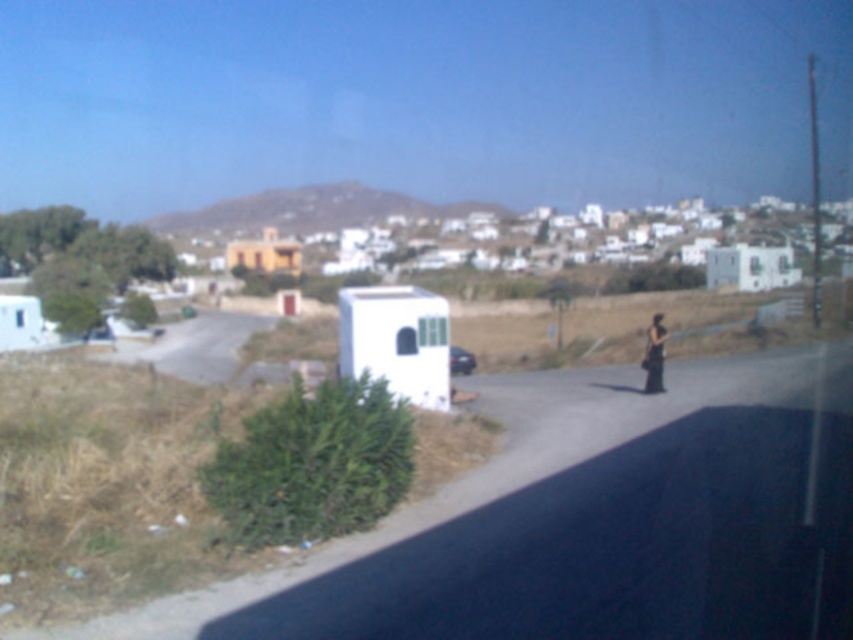
Between black fabric bag at center and white matte trailer at center, which one is positioned higher?

black fabric bag at center is higher up.

What do you see at coordinates (654, 355) in the screenshot? This screenshot has height=640, width=853. I see `black fabric bag at center` at bounding box center [654, 355].

The image size is (853, 640). In order to click on black fabric bag at center in this screenshot , I will do `click(654, 355)`.